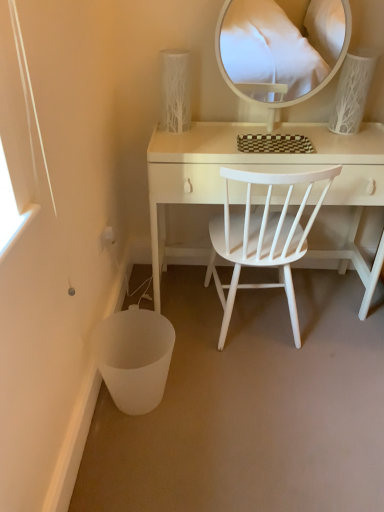
The height and width of the screenshot is (512, 384). Find the location of `vacant point to the right of white glossy mirror at upper center`. vacant point to the right of white glossy mirror at upper center is located at coordinates (341, 138).